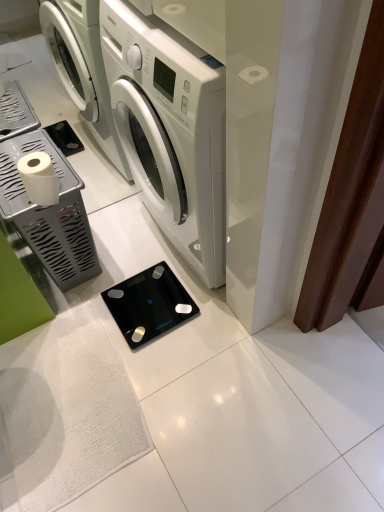
The image size is (384, 512). Find the location of `white glossy washing machine at center`. white glossy washing machine at center is located at coordinates (170, 129).

Find the location of a particular element. This screenshot has width=384, height=512. white matte toilet paper at left is located at coordinates (39, 178).

From the image's perspective, is black glass scale at center, acting as the first appliance starting from the right, located above silver metallic toilet paper holder at left, placed as the 1th appliance when sorted from left to right?

No, from the image's perspective, black glass scale at center, acting as the first appliance starting from the right, is not on top of silver metallic toilet paper holder at left, placed as the 1th appliance when sorted from left to right.

Considering their positions, is black glass scale at center, the 2th appliance from the left, located in front of or behind silver metallic toilet paper holder at left, placed as the 1th appliance when sorted from left to right?

Visually, black glass scale at center, the 2th appliance from the left, is located behind silver metallic toilet paper holder at left, placed as the 1th appliance when sorted from left to right.

Which of these two, black glass scale at center, acting as the first appliance starting from the right, or silver metallic toilet paper holder at left, placed as the 1th appliance when sorted from left to right, is smaller?

Result: With smaller size is black glass scale at center, acting as the first appliance starting from the right.

In the scene shown: Considering the relative sizes of black glass scale at center, the 2th appliance from the left, and white matte toilet paper at left in the image provided, is black glass scale at center, the 2th appliance from the left, bigger than white matte toilet paper at left?

Incorrect, black glass scale at center, the 2th appliance from the left, is not larger than white matte toilet paper at left.

Is black glass scale at center, acting as the first appliance starting from the right, wider or thinner than white matte toilet paper at left?

Clearly, black glass scale at center, acting as the first appliance starting from the right, has more width compared to white matte toilet paper at left.

Is black glass scale at center, the 2th appliance from the left, at the left side of white matte toilet paper at left?

No, black glass scale at center, the 2th appliance from the left, is not to the left of white matte toilet paper at left.

From the image's perspective, is white matte toilet paper at left under black glass scale at center, acting as the first appliance starting from the right?

No, from the image's perspective, white matte toilet paper at left is not beneath black glass scale at center, acting as the first appliance starting from the right.

Is white matte toilet paper at left to the right of black glass scale at center, the 2th appliance from the left, from the viewer's perspective?

No.

Can you tell me how much white matte toilet paper at left and black glass scale at center, acting as the first appliance starting from the right, differ in facing direction?

white matte toilet paper at left and black glass scale at center, acting as the first appliance starting from the right, are facing 180 degrees away from each other.

Consider the image. From a real-world perspective, does white matte toilet paper at left sit lower than black glass scale at center, the 2th appliance from the left?

Actually, white matte toilet paper at left is physically above black glass scale at center, the 2th appliance from the left, in the real world.

Which of these two, white glossy washing machine at center or black glass scale at center, acting as the first appliance starting from the right, is smaller?

black glass scale at center, acting as the first appliance starting from the right, is smaller.

Consider the image. From the image's perspective, is white glossy washing machine at center located above or below black glass scale at center, acting as the first appliance starting from the right?

From the image's perspective, white glossy washing machine at center appears above black glass scale at center, acting as the first appliance starting from the right.

Is white glossy washing machine at center oriented towards black glass scale at center, acting as the first appliance starting from the right?

Yes, white glossy washing machine at center is facing black glass scale at center, acting as the first appliance starting from the right.

Does white glossy washing machine at center appear on the left side of black glass scale at center, the 2th appliance from the left?

Incorrect, white glossy washing machine at center is not on the left side of black glass scale at center, the 2th appliance from the left.

Which is more to the left, silver metallic toilet paper holder at left, which is counted as the 2th appliance, starting from the right, or white matte toilet paper at left?

silver metallic toilet paper holder at left, which is counted as the 2th appliance, starting from the right.

From a real-world perspective, count 1st appliances downward from the white matte toilet paper at left and point to it. Please provide its 2D coordinates.

[(48, 214)]

Is silver metallic toilet paper holder at left, which is counted as the 2th appliance, starting from the right, positioned far away from white matte toilet paper at left?

No, there isn't a large distance between silver metallic toilet paper holder at left, which is counted as the 2th appliance, starting from the right, and white matte toilet paper at left.

Is silver metallic toilet paper holder at left, placed as the 1th appliance when sorted from left to right, behind white matte toilet paper at left?

Yes.

Would you say black glass scale at center, the 2th appliance from the left, is part of silver metallic toilet paper holder at left, placed as the 1th appliance when sorted from left to right,'s contents?

No, black glass scale at center, the 2th appliance from the left, is not surrounded by silver metallic toilet paper holder at left, placed as the 1th appliance when sorted from left to right.

Which is more to the right, silver metallic toilet paper holder at left, which is counted as the 2th appliance, starting from the right, or black glass scale at center, acting as the first appliance starting from the right?

black glass scale at center, acting as the first appliance starting from the right, is more to the right.

I want to click on appliance that appears in front of the black glass scale at center, acting as the first appliance starting from the right, so click(48, 214).

From a real-world perspective, relative to black glass scale at center, acting as the first appliance starting from the right, is silver metallic toilet paper holder at left, placed as the 1th appliance when sorted from left to right, vertically above or below?

silver metallic toilet paper holder at left, placed as the 1th appliance when sorted from left to right, is above black glass scale at center, acting as the first appliance starting from the right.

Is black glass scale at center, acting as the first appliance starting from the right, smaller than white glossy washing machine at center?

Yes.

From a real-world perspective, is black glass scale at center, acting as the first appliance starting from the right, physically located above or below white glossy washing machine at center?

In terms of real-world spatial position, black glass scale at center, acting as the first appliance starting from the right, is below white glossy washing machine at center.

Is point (167, 298) closer to viewer compared to point (115, 30)?

No, it is behind (115, 30).

Is black glass scale at center, the 2th appliance from the left, closer to camera compared to white glossy washing machine at center?

That is False.

Where is `appliance below the silver metallic toilet paper holder at left, placed as the 1th appliance when sorted from left to right (from the image's perspective)`? This screenshot has height=512, width=384. appliance below the silver metallic toilet paper holder at left, placed as the 1th appliance when sorted from left to right (from the image's perspective) is located at coordinates (149, 304).

Image resolution: width=384 pixels, height=512 pixels. There is a white matte toilet paper at left. Find the location of `the 2nd appliance below it (from a real-world perspective)`. the 2nd appliance below it (from a real-world perspective) is located at coordinates (149, 304).

Based on their spatial positions, is black glass scale at center, acting as the first appliance starting from the right, or white matte toilet paper at left further from white glossy washing machine at center?

The object further to white glossy washing machine at center is black glass scale at center, acting as the first appliance starting from the right.

Considering their positions, is white matte toilet paper at left positioned closer to black glass scale at center, the 2th appliance from the left, than white glossy washing machine at center?

Among the two, white glossy washing machine at center is located nearer to black glass scale at center, the 2th appliance from the left.

Looking at the image, which one is located closer to silver metallic toilet paper holder at left, which is counted as the 2th appliance, starting from the right, white matte toilet paper at left or black glass scale at center, the 2th appliance from the left?

Among the two, white matte toilet paper at left is located nearer to silver metallic toilet paper holder at left, which is counted as the 2th appliance, starting from the right.

Which object lies nearer to the anchor point white matte toilet paper at left, white glossy washing machine at center or black glass scale at center, the 2th appliance from the left?

The object closer to white matte toilet paper at left is white glossy washing machine at center.

Looking at the image, which one is located further to white glossy washing machine at center, silver metallic toilet paper holder at left, placed as the 1th appliance when sorted from left to right, or white matte toilet paper at left?

white matte toilet paper at left is further to white glossy washing machine at center.

Estimate the real-world distances between objects in this image. Which object is closer to silver metallic toilet paper holder at left, which is counted as the 2th appliance, starting from the right, black glass scale at center, acting as the first appliance starting from the right, or white matte toilet paper at left?

white matte toilet paper at left is positioned closer to the anchor silver metallic toilet paper holder at left, which is counted as the 2th appliance, starting from the right.

When comparing their distances from black glass scale at center, the 2th appliance from the left, does silver metallic toilet paper holder at left, placed as the 1th appliance when sorted from left to right, or white glossy washing machine at center seem further?

white glossy washing machine at center is further to black glass scale at center, the 2th appliance from the left.

Which object lies nearer to the anchor point white matte toilet paper at left, black glass scale at center, the 2th appliance from the left, or white glossy washing machine at center?

white glossy washing machine at center is closer to white matte toilet paper at left.

This screenshot has height=512, width=384. In order to click on appliance between white matte toilet paper at left and black glass scale at center, the 2th appliance from the left, from top to bottom in this screenshot , I will do `click(48, 214)`.

Identify the location of appliance between white glossy washing machine at center and black glass scale at center, acting as the first appliance starting from the right, along the z-axis. (48, 214).

Where is `toilet paper between silver metallic toilet paper holder at left, which is counted as the 2th appliance, starting from the right, and white glossy washing machine at center, in the horizontal direction`? Image resolution: width=384 pixels, height=512 pixels. toilet paper between silver metallic toilet paper holder at left, which is counted as the 2th appliance, starting from the right, and white glossy washing machine at center, in the horizontal direction is located at coordinates pyautogui.click(x=39, y=178).

This screenshot has height=512, width=384. I want to click on toilet paper located between white glossy washing machine at center and black glass scale at center, acting as the first appliance starting from the right, in the depth direction, so click(39, 178).